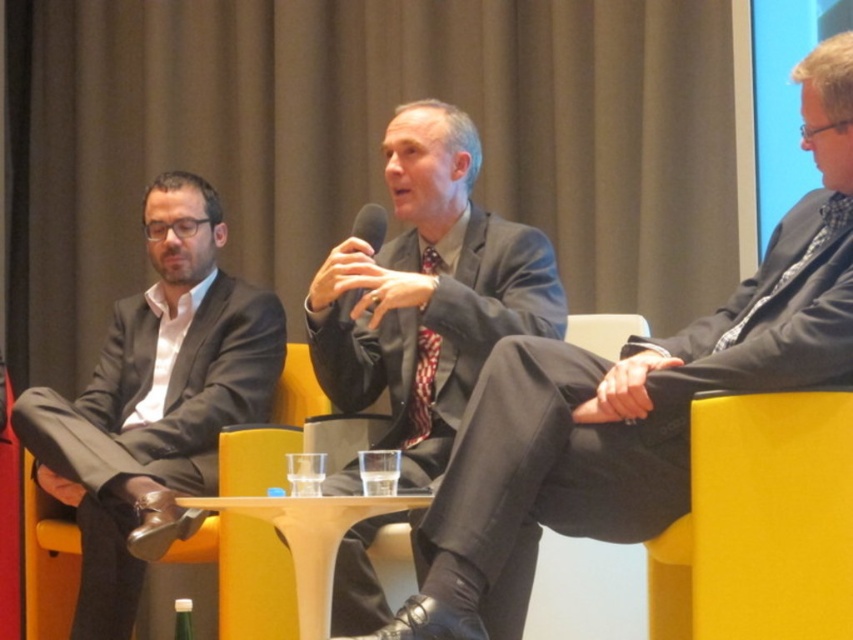
Question: Does matte black suit at left have a larger size compared to matte gray suit at center?

Choices:
 (A) no
 (B) yes

Answer: (B)

Question: Observing the image, what is the correct spatial positioning of matte black suit at left in reference to black plastic microphone at center?

Choices:
 (A) left
 (B) right

Answer: (A)

Question: Which point is farther from the camera taking this photo?

Choices:
 (A) (547, 438)
 (B) (444, 112)
 (C) (164, 406)

Answer: (C)

Question: Considering the real-world distances, which object is closest to the black plastic microphone at center?

Choices:
 (A) matte gray suit at center
 (B) matte black suit at center

Answer: (A)

Question: Which object appears closest to the camera in this image?

Choices:
 (A) black plastic microphone at center
 (B) matte black suit at left
 (C) matte black suit at center
 (D) matte gray suit at center

Answer: (C)

Question: Can you confirm if matte gray suit at center is positioned below black plastic microphone at center?

Choices:
 (A) no
 (B) yes

Answer: (B)